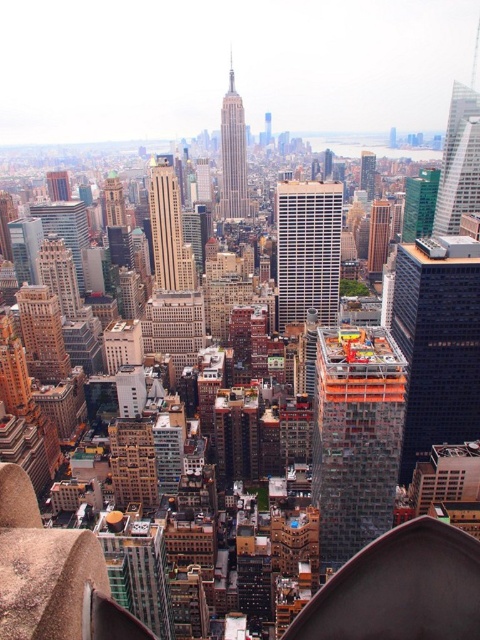
Question: Estimate the real-world distances between objects in this image. Which object is closer to the glassy reflective skyscraper at upper right?

Choices:
 (A) white glass building at center
 (B) black glass building at center-right
 (C) silver metallic tower at center

Answer: (B)

Question: Observing the image, what is the correct spatial positioning of black glass building at center-right in reference to glassy skyscraper at center?

Choices:
 (A) right
 (B) left

Answer: (A)

Question: Does beige stone skyscraper at center have a lesser width compared to brown brick building at center?

Choices:
 (A) no
 (B) yes

Answer: (A)

Question: Among these objects, which one is farthest from the camera?

Choices:
 (A) brown brick building at center
 (B) silver metallic tower at center

Answer: (A)

Question: Observing the image, what is the correct spatial positioning of glassy reflective skyscraper at upper right in reference to silver metallic tower at center?

Choices:
 (A) left
 (B) right

Answer: (B)

Question: Estimate the real-world distances between objects in this image. Which object is closer to the beige stone skyscraper at center?

Choices:
 (A) green glass skyscraper at center
 (B) silver metallic tower at center
 (C) brown brick building at center
 (D) white glass building at center

Answer: (B)